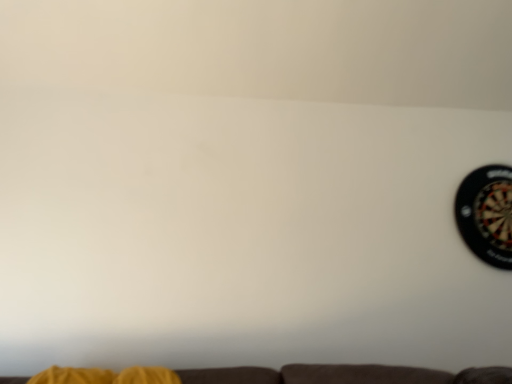
At what (x,y) coordinates should I click in order to perform the action: click on black plastic dartboard at right. Please return your answer as a coordinate pair (x, y). Looking at the image, I should click on (487, 214).

Image resolution: width=512 pixels, height=384 pixels. What do you see at coordinates (487, 214) in the screenshot?
I see `black plastic dartboard at right` at bounding box center [487, 214].

Identify the location of black plastic dartboard at right. (487, 214).